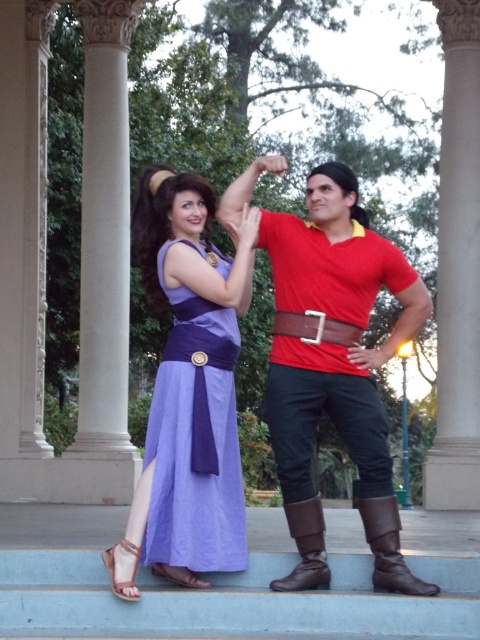
Between matte red shirt at center and purple satin dress at center, which one appears on the right side from the viewer's perspective?

matte red shirt at center is more to the right.

Between matte red shirt at center and purple satin dress at center, which one has less height?

purple satin dress at center

Find the location of `matte red shirt at center`. matte red shirt at center is located at coordinates (336, 371).

Looking at this image, is purple satin dress at center wider than brown leather belt at center?

Indeed, purple satin dress at center has a greater width compared to brown leather belt at center.

Can you confirm if purple satin dress at center is taller than brown leather belt at center?

Correct, purple satin dress at center is much taller as brown leather belt at center.

Is point (168, 387) farther from camera compared to point (314, 326)?

No, it is in front of (314, 326).

You are a GUI agent. You are given a task and a screenshot of the screen. Output one action in this format:
    pyautogui.click(x=<x>, y=<y>)
    Task: Click on the purple satin dress at center
    
    Given the screenshot: What is the action you would take?
    pyautogui.click(x=194, y=440)

Does matte red shirt at center have a larger size compared to brown leather boot at lower center?

Yes, matte red shirt at center is bigger than brown leather boot at lower center.

Does matte red shirt at center have a lesser height compared to brown leather boot at lower center?

Incorrect, matte red shirt at center's height does not fall short of brown leather boot at lower center's.

Describe the element at coordinates (336, 371) in the screenshot. I see `matte red shirt at center` at that location.

Where is `matte red shirt at center`? The height and width of the screenshot is (640, 480). matte red shirt at center is located at coordinates (336, 371).